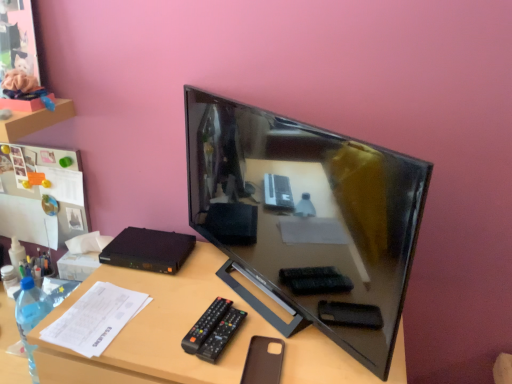
You are a GUI agent. You are given a task and a screenshot of the screen. Output one action in this format:
    pyautogui.click(x=<x>, y=<y>)
    Task: Click on the free space behind brown leather phone case at lower center
    
    Given the screenshot: What is the action you would take?
    pyautogui.click(x=254, y=309)